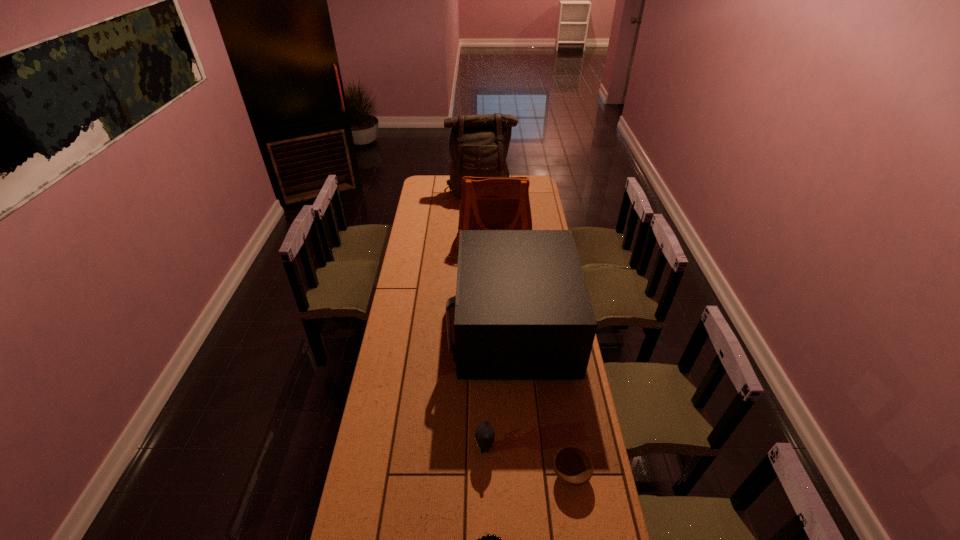
Image resolution: width=960 pixels, height=540 pixels. I want to click on the tallest object, so click(478, 146).

At what (x,y) coordinates should I click in order to perform the action: click on backpack. Please return your answer as a coordinate pair (x, y). Image resolution: width=960 pixels, height=540 pixels. Looking at the image, I should click on (478, 146).

The height and width of the screenshot is (540, 960). I want to click on the fifth nearest object, so click(487, 203).

The image size is (960, 540). I want to click on the second tallest object, so click(487, 203).

Where is `the third tallest object`? the third tallest object is located at coordinates (522, 309).

Where is `microwave oven`? The image size is (960, 540). microwave oven is located at coordinates (522, 309).

Identify the location of kitten. Image resolution: width=960 pixels, height=540 pixels. (484, 434).

I want to click on the fifth tallest object, so click(573, 467).

This screenshot has width=960, height=540. In order to click on vacant point located 0.340m on the open flap of the farthest object in this screenshot , I will do click(x=480, y=240).

The height and width of the screenshot is (540, 960). Find the location of `vacant space located on the front pocket of the fifth shortest object`. vacant space located on the front pocket of the fifth shortest object is located at coordinates point(495,265).